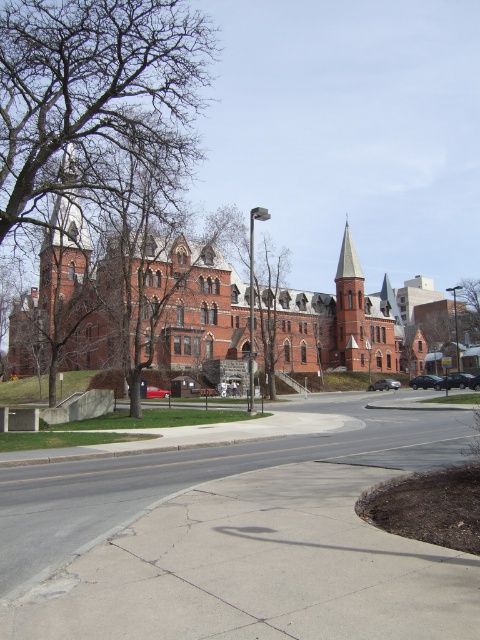
Question: Which point is farther to the camera?

Choices:
 (A) (116, 337)
 (B) (109, 115)

Answer: (A)

Question: Considering the relative positions of concrete sidewalk at center and red brick church at center in the image provided, where is concrete sidewalk at center located with respect to red brick church at center?

Choices:
 (A) below
 (B) above

Answer: (A)

Question: Which of the following is the closest to the observer?

Choices:
 (A) concrete sidewalk at center
 (B) brown leafless tree at upper left

Answer: (A)

Question: Based on their relative distances, which object is nearer to the concrete sidewalk at center?

Choices:
 (A) red brick church at center
 (B) brown leafless tree at upper left

Answer: (B)

Question: Can you confirm if concrete sidewalk at center is positioned to the right of brown textured tree at center?

Choices:
 (A) yes
 (B) no

Answer: (B)

Question: Where is concrete sidewalk at center located in relation to brown textured tree at center in the image?

Choices:
 (A) below
 (B) above

Answer: (A)